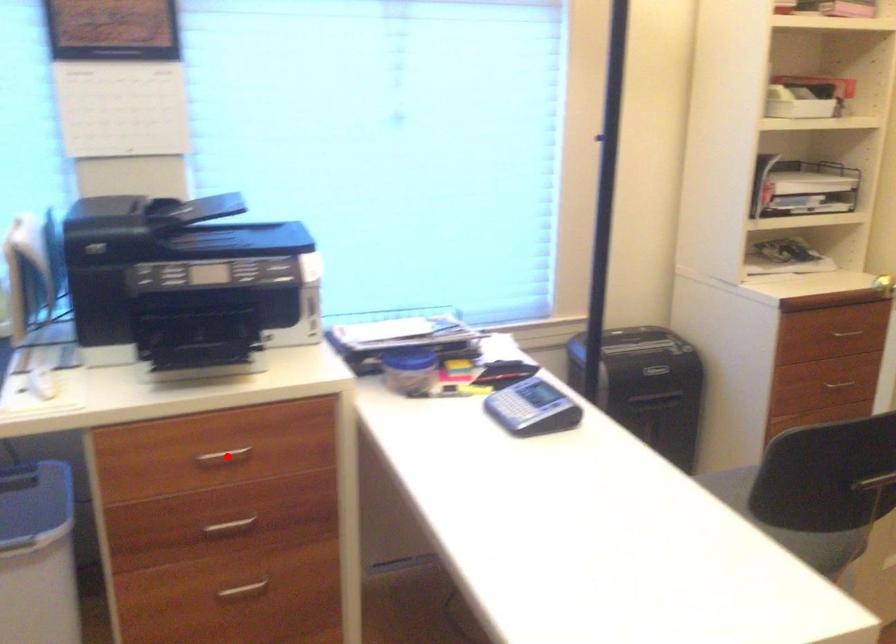
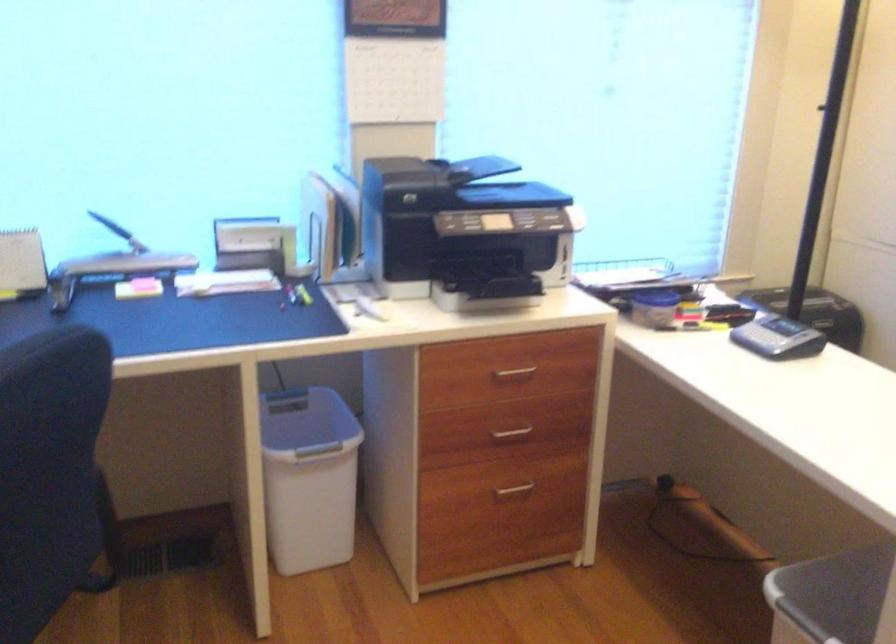
Question: I am providing you with two images of the same scene from different viewpoints. Given a red point in image1, look at the same physical point in image2. Is it:

Choices:
 (A) Closer to the viewpoint
 (B) Farther from the viewpoint

Answer: (B)